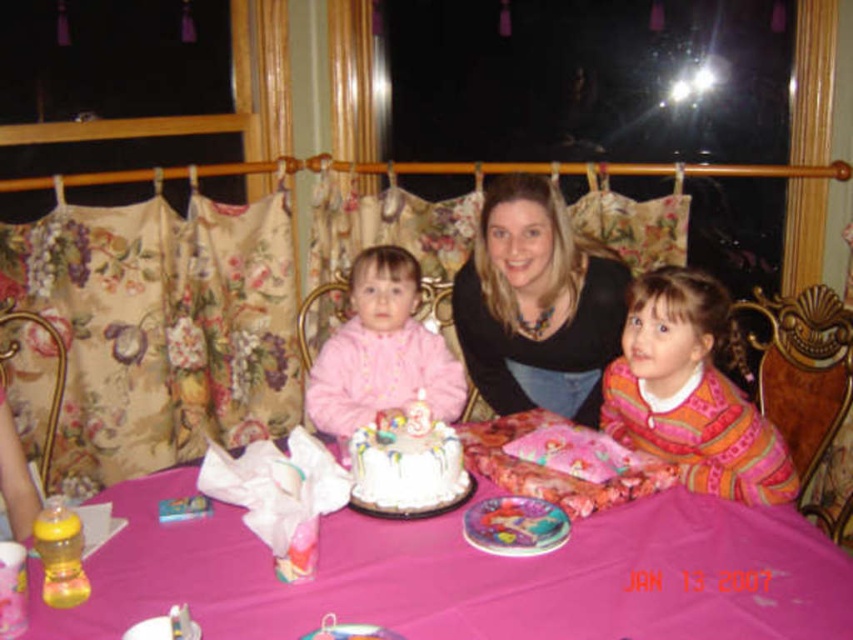
Between matte black sweater at center and pink fleece jacket at center, which one is positioned higher?

Positioned higher is matte black sweater at center.

Who is more distant from viewer, [543,205] or [386,259]?

Positioned behind is point [386,259].

I want to click on matte black sweater at center, so pyautogui.click(x=537, y=304).

The image size is (853, 640). Describe the element at coordinates (469, 577) in the screenshot. I see `pink fabric table at center` at that location.

Does pink fabric table at center have a larger size compared to white frosted cake at center?

Correct, pink fabric table at center is larger in size than white frosted cake at center.

What do you see at coordinates (469, 577) in the screenshot? I see `pink fabric table at center` at bounding box center [469, 577].

The width and height of the screenshot is (853, 640). In order to click on pink fabric table at center in this screenshot , I will do `click(469, 577)`.

Who is shorter, pink fabric table at center or matte black sweater at center?

With less height is pink fabric table at center.

Can you confirm if pink fabric table at center is positioned to the left of matte black sweater at center?

Yes, pink fabric table at center is to the left of matte black sweater at center.

The image size is (853, 640). Identify the location of pink fabric table at center. (469, 577).